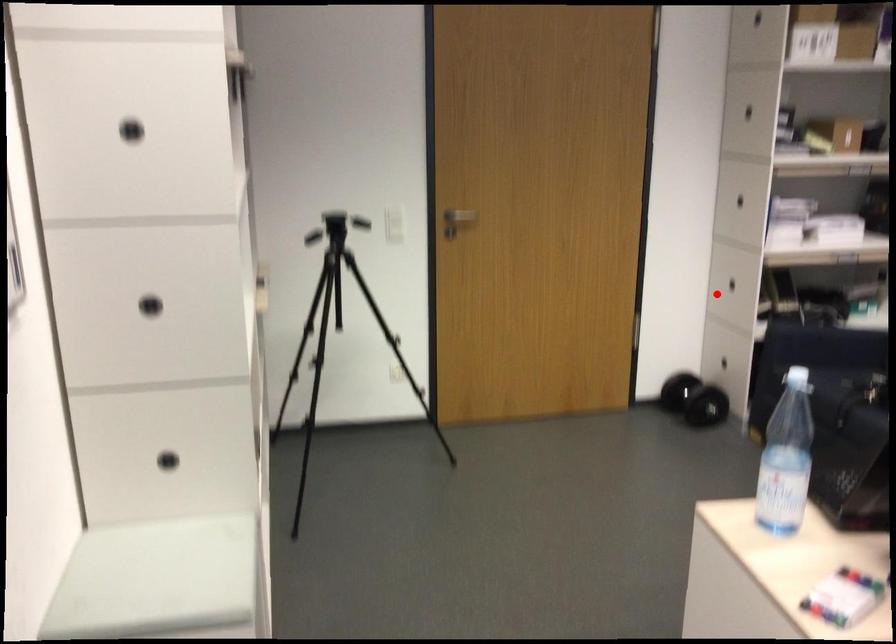
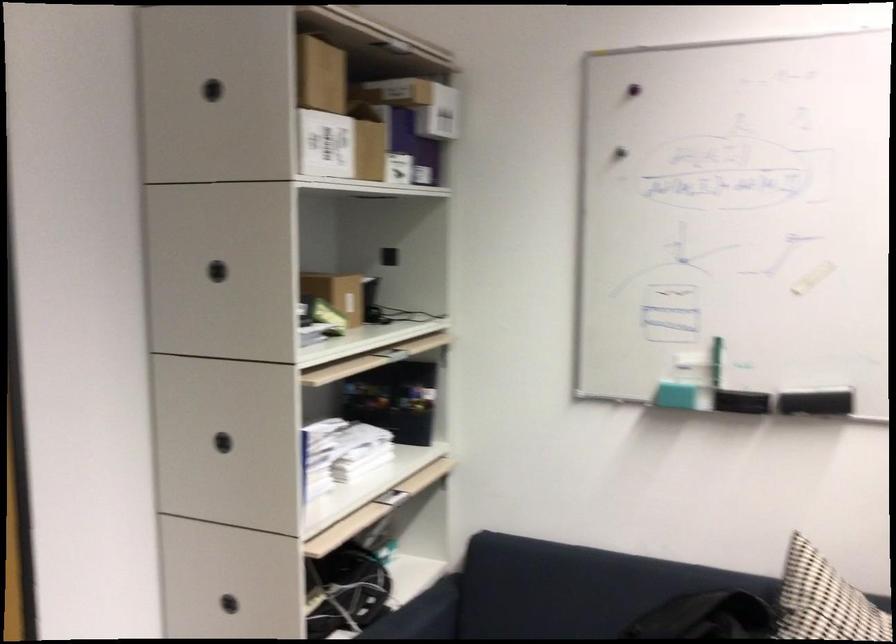
Find the pixel in the second image that matches the highlighted location in the first image.

(228, 603)